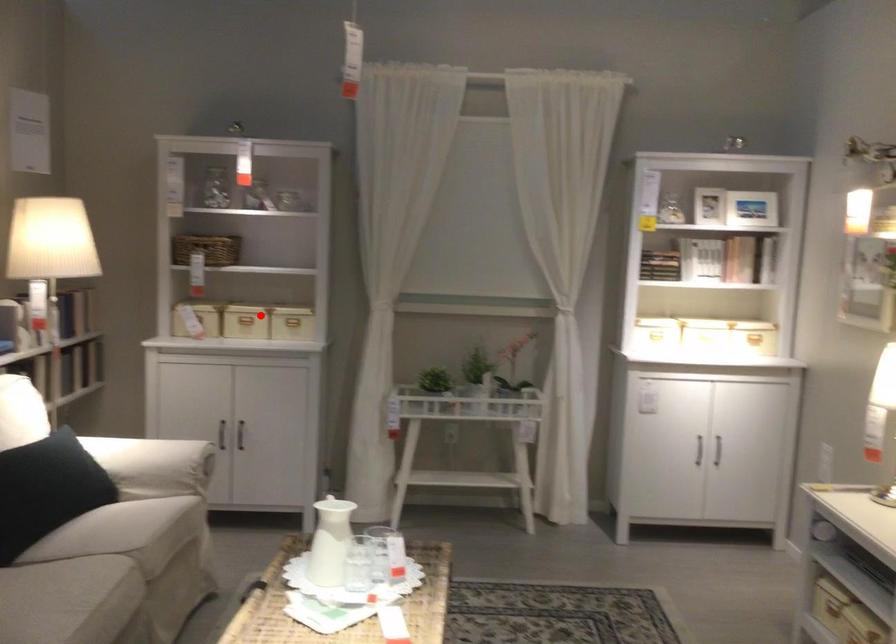
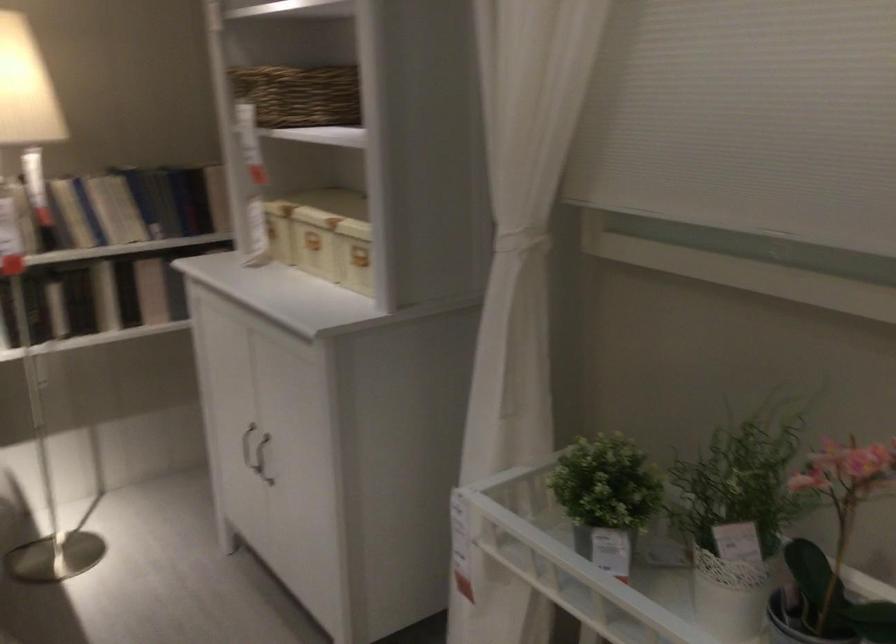
Question: A red point is marked in image1. In image2, is the corresponding 3D point closer to the camera or farther? Reply with the corresponding letter.

Choices:
 (A) The corresponding 3D point is closer.
 (B) The corresponding 3D point is farther.

Answer: (A)